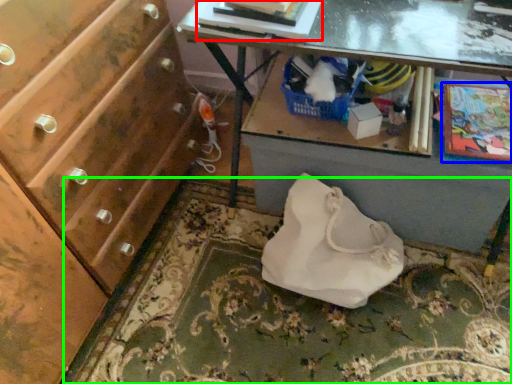
Question: Estimate the real-world distances between objects in this image. Which object is closer to book (highlighted by a red box), comic book (highlighted by a blue box) or mat (highlighted by a green box)?

Choices:
 (A) comic book
 (B) mat

Answer: (A)